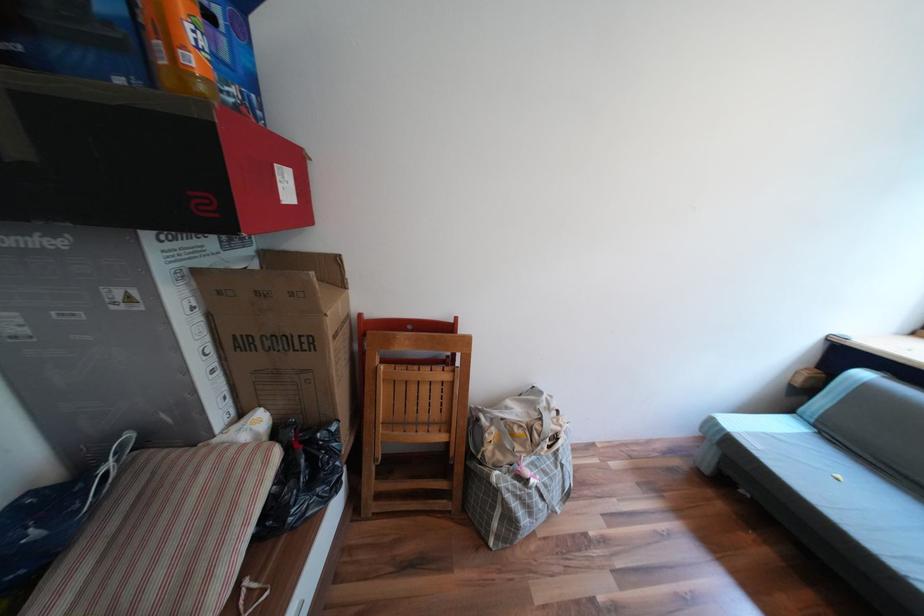
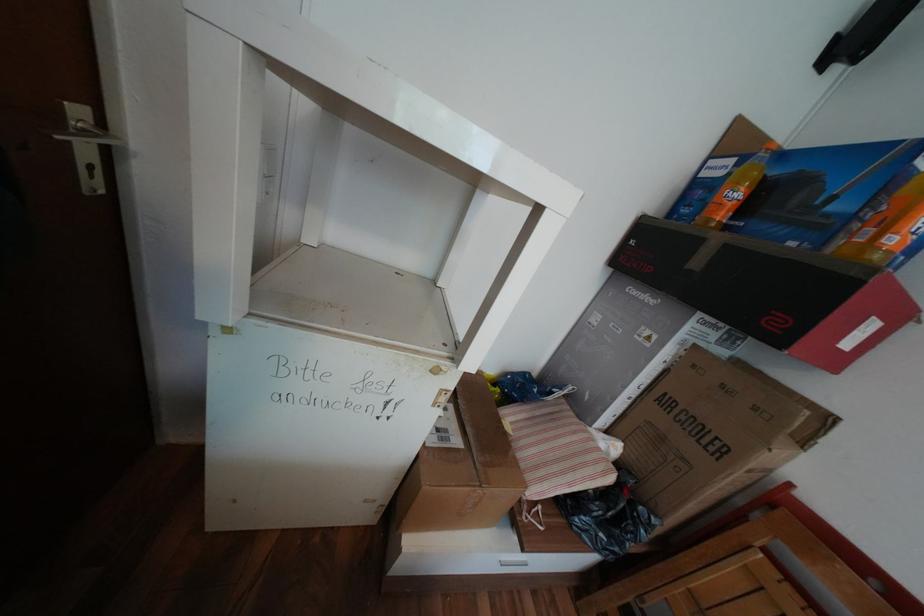
Question: Based on the continuous images, in which direction is the camera rotating? Reply with the corresponding letter.

Choices:
 (A) Left
 (B) Right
 (C) Up
 (D) Down

Answer: (A)